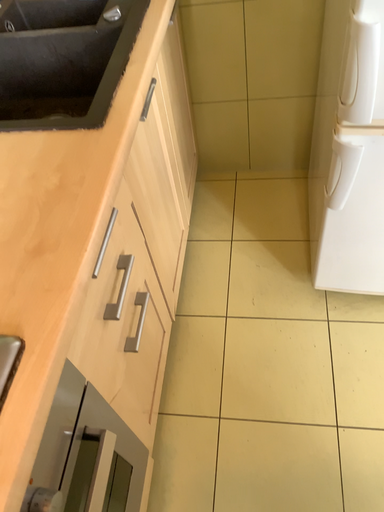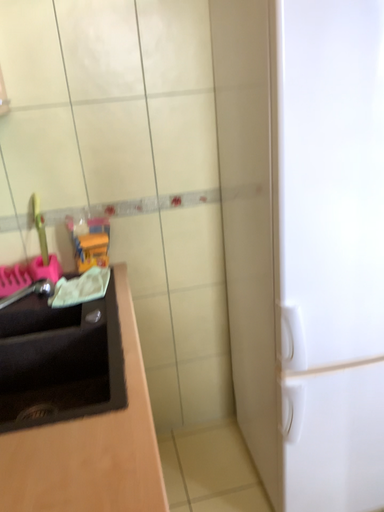
Question: How did the camera likely rotate when shooting the video?

Choices:
 (A) rotated right
 (B) rotated left

Answer: (A)